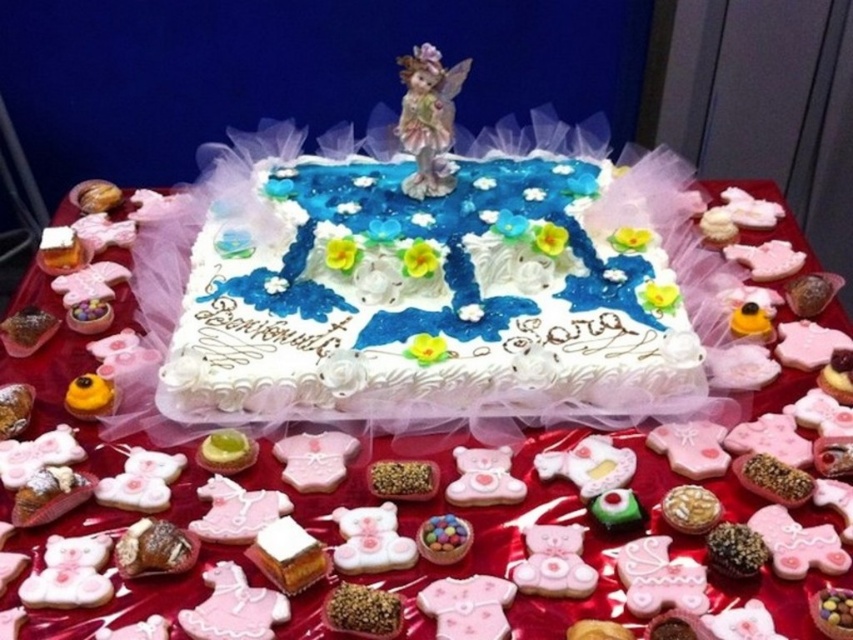
Does point (181, 420) lie behind point (532, 499)?

Yes, point (181, 420) is farther from viewer.

Which is behind, point (450, 260) or point (126, 436)?

The point (450, 260) is behind.

Find the location of a particular element. This screenshot has height=640, width=853. white fondant cake at center is located at coordinates point(440,298).

Does white frosted cake at center come in front of matte plastic eggs at center?

Yes, it is in front of matte plastic eggs at center.

Image resolution: width=853 pixels, height=640 pixels. Describe the element at coordinates (427, 509) in the screenshot. I see `white frosted cake at center` at that location.

Who is more distant from viewer, (643, 436) or (445, 532)?

The point (643, 436) is behind.

Locate an element on the screen. Image resolution: width=853 pixels, height=640 pixels. white frosted cake at center is located at coordinates (427, 509).

Is white fondant cake at center behind matte plastic eggs at center?

Yes, it is.

Is white fondant cake at center wider than matte plastic eggs at center?

Yes, white fondant cake at center is wider than matte plastic eggs at center.

Between point (548, 291) and point (421, 544), which one is positioned in front?

Point (421, 544) is more forward.

The width and height of the screenshot is (853, 640). I want to click on white fondant cake at center, so click(440, 298).